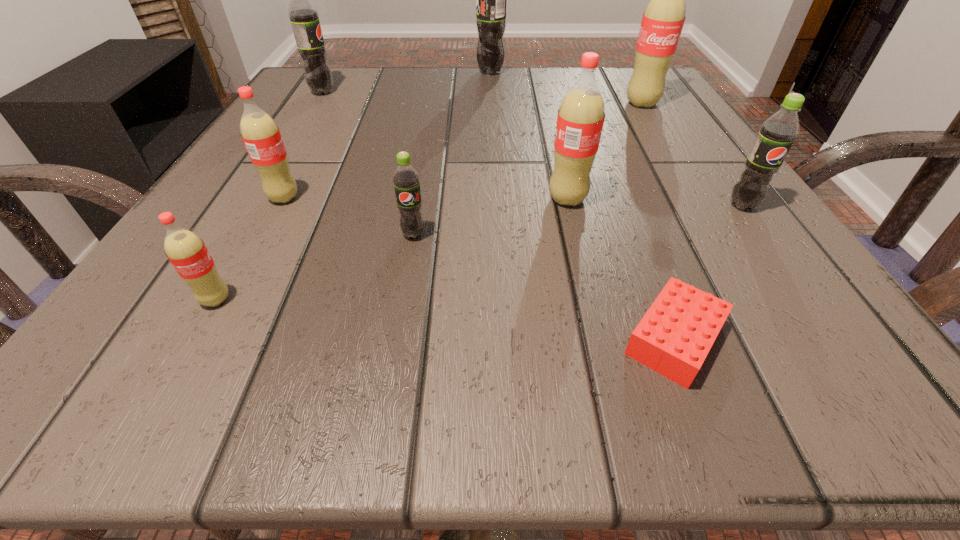
Where is `the rightmost green soda`? the rightmost green soda is located at coordinates (777, 133).

Find the location of a particular element. the fourth soda from left to right is located at coordinates (406, 179).

This screenshot has width=960, height=540. In order to click on the smallest green soda in this screenshot , I will do `click(406, 179)`.

Where is `the smallest red soda`? This screenshot has width=960, height=540. the smallest red soda is located at coordinates (188, 254).

In order to click on the nearest soda in this screenshot , I will do `click(188, 254)`.

This screenshot has height=540, width=960. What are the coordinates of `Lego` in the screenshot? It's located at (675, 335).

Identify the location of free location located on the front label of the third green soda from left to right. (306, 72).

Identify the location of vacant space located on the front label of the third green soda from left to right. This screenshot has height=540, width=960. (412, 72).

Locate an element on the screen. This screenshot has width=960, height=540. free space located 0.110m on the front label of the third green soda from left to right is located at coordinates (425, 72).

You are a GUI agent. You are given a task and a screenshot of the screen. Output one action in this format:
    pyautogui.click(x=<x>, y=<y>)
    Task: Click on the vacant space located on the front of the farthest red soda
    Image resolution: width=960 pixels, height=540 pixels.
    Given the screenshot: What is the action you would take?
    pyautogui.click(x=694, y=190)